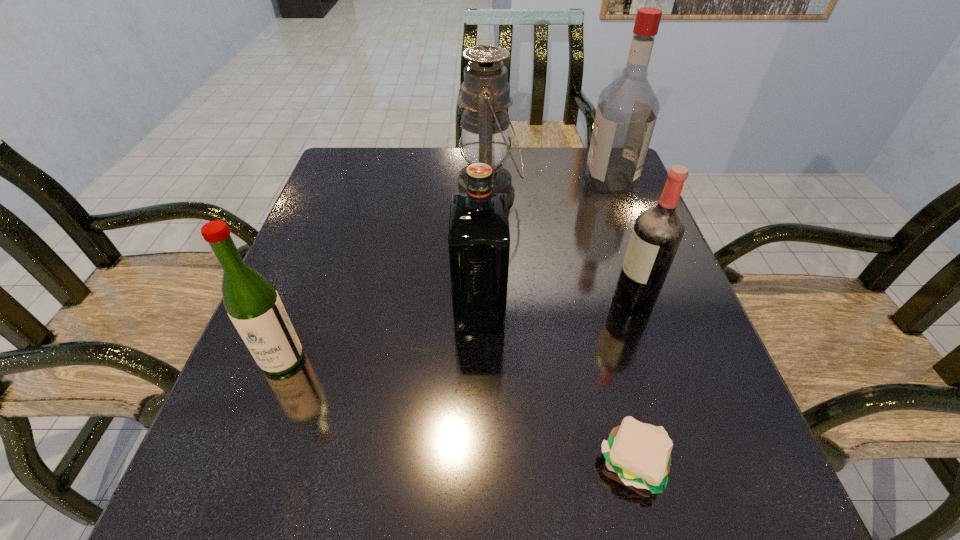
You are a GUI agent. You are given a task and a screenshot of the screen. Output one action in this format:
    pyautogui.click(x=<x>, y=<y>)
    Task: Click on the blank space located on the back of the oil lamp
    This screenshot has width=960, height=540.
    Given the screenshot: What is the action you would take?
    pyautogui.click(x=488, y=151)

Where is `vacant area situated on the front label of the third liquor from right to left`? The width and height of the screenshot is (960, 540). vacant area situated on the front label of the third liquor from right to left is located at coordinates (654, 308).

Identify the location of free space located 0.070m on the label of the second nearest object. This screenshot has height=540, width=960. (261, 414).

The width and height of the screenshot is (960, 540). What are the coordinates of `free space located on the back of the shortest object` in the screenshot? It's located at (612, 375).

Locate an element on the screen. The width and height of the screenshot is (960, 540). liquor located at the far edge is located at coordinates (627, 109).

Find the location of a particular element. Image resolution: width=960 pixels, height=540 pixels. oil lamp that is at the far edge is located at coordinates (485, 93).

Locate an element on the screen. This screenshot has width=960, height=540. object present at the near edge is located at coordinates (639, 453).

Identify the location of object present at the left edge. point(252,303).

Image resolution: width=960 pixels, height=540 pixels. Identify the location of patty at the right edge. (639, 453).

Find the location of a particular element. The height and width of the screenshot is (540, 960). object located in the far right corner section of the desktop is located at coordinates (627, 109).